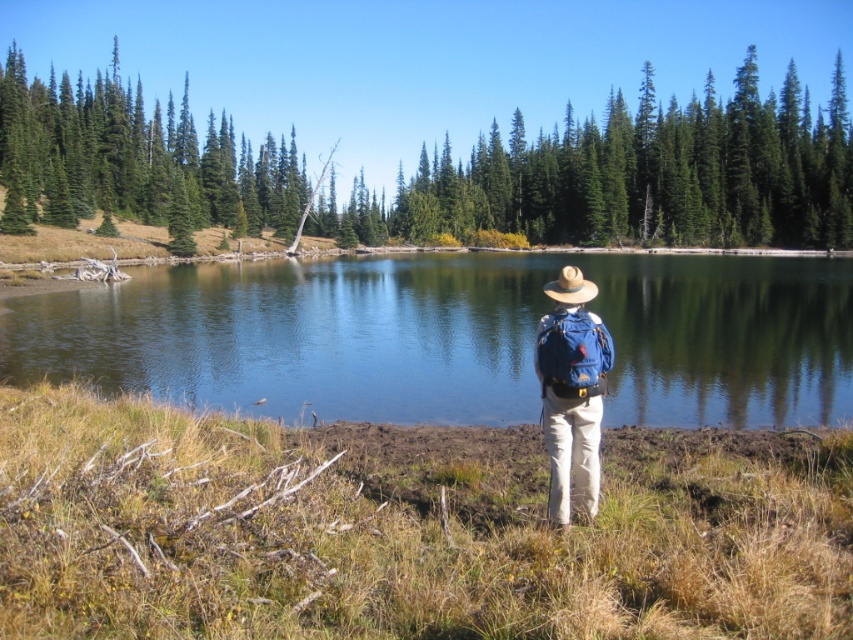
Question: Among these points, which one is farthest from the camera?

Choices:
 (A) (566, 480)
 (B) (672, 264)
 (C) (584, 301)

Answer: (B)

Question: Among these objects, which one is nearest to the camera?

Choices:
 (A) clear water at center
 (B) brown straw cowboy hat at center

Answer: (A)

Question: Is blue fabric backpack at center wider than brown straw cowboy hat at center?

Choices:
 (A) yes
 (B) no

Answer: (B)

Question: Can you confirm if clear water at center is thinner than brown straw cowboy hat at center?

Choices:
 (A) no
 (B) yes

Answer: (A)

Question: In this image, where is clear water at center located relative to blue fabric backpack at center?

Choices:
 (A) above
 (B) below

Answer: (A)

Question: Which of the following is the closest to the observer?

Choices:
 (A) (556, 292)
 (B) (231, 333)
 (C) (558, 444)

Answer: (C)